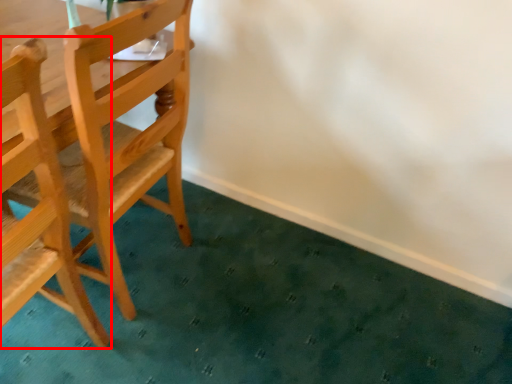
Question: From the image's perspective, considering the relative positions of chair (annotated by the red box) and chair in the image provided, where is chair (annotated by the red box) located with respect to the staircase?

Choices:
 (A) below
 (B) above

Answer: (A)